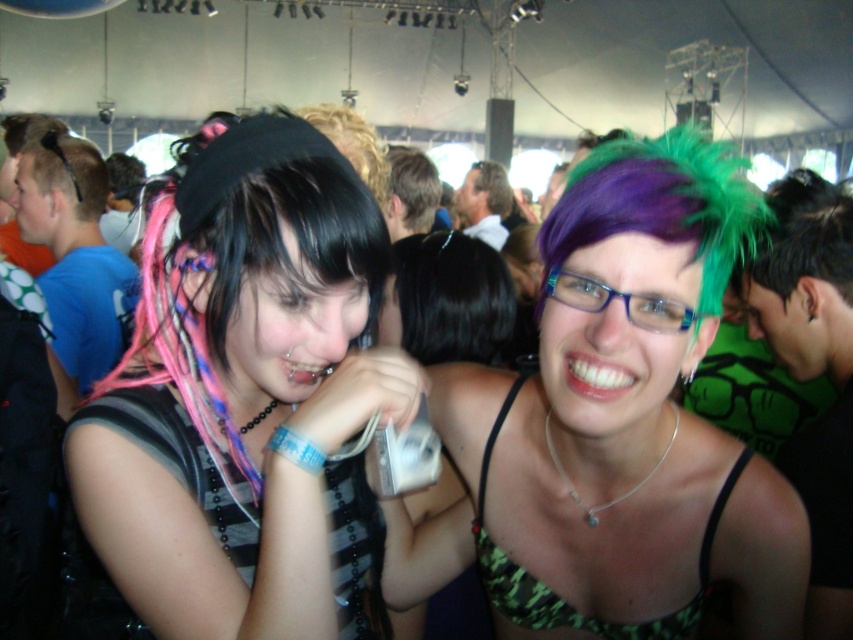
You are a photographer at the music festival and want to capture both the multicolored hair at center and the green camouflage bikini top at center in a single shot. Which of the two objects should you focus on first to ensure they both appear clear in the photo?

The multicolored hair at center is bigger than the green camouflage bikini top at center, so focusing on the multicolored hair at center first will help ensure both objects are in focus as it is the larger subject.

You are at the music festival and want to take a photo of the multicolored hair at center and the green camouflage bikini top at center. Which object should you focus on first to ensure both are in the frame?

The multicolored hair at center is closer to the viewer than the green camouflage bikini top at center, so focus on the multicolored hair at center first to ensure both are in focus and the frame.